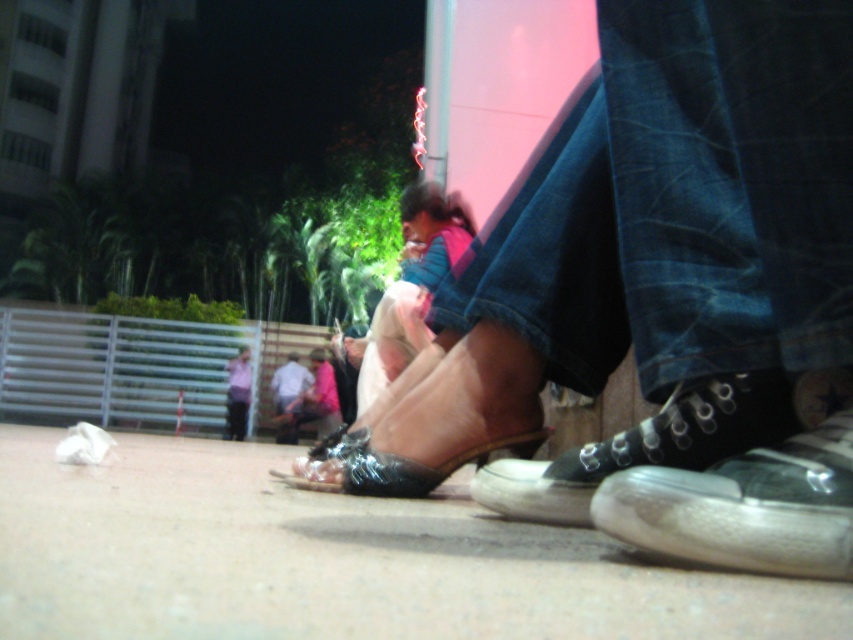
You are a photographer trying to capture a candid shot of the light blue shirt at lower center and the black canvas shoe at lower right. Since you want to ensure both are in focus, you need to know which one is closer to the camera. Can you determine which object is nearer?

The black canvas shoe at lower right has a lesser width compared to the light blue shirt at lower center, so it is closer to the camera.

You are a photographer trying to capture both the white canvas sneaker at lower right and the black canvas shoe at lower right in a single frame. Given their sizes, which one should you focus on to ensure both fit clearly in the photo?

Since the white canvas sneaker at lower right is smaller than the black canvas shoe at lower right, you should focus on the black canvas shoe at lower right as it takes up more space, allowing the smaller white canvas sneaker at lower right to fit alongside it in the frame.

Looking at this image, you are a photographer trying to capture the shiny black sandal at center and the light blue shirt at lower center in a single shot. Based on their positions, which object should you focus on first to ensure both are in frame?

The shiny black sandal at center is above the light blue shirt at lower center, so you should focus on the shiny black sandal at center first to ensure both are in frame.